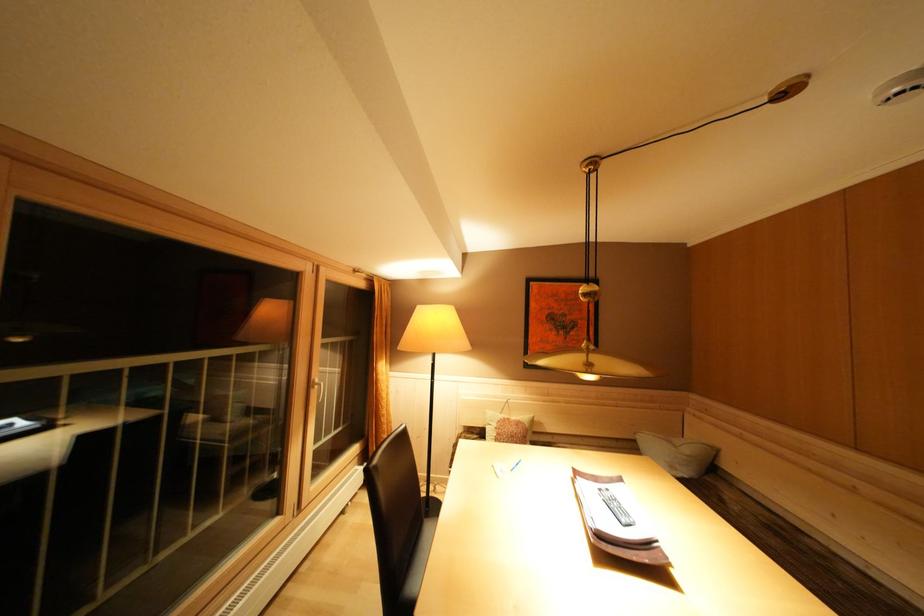
This screenshot has width=924, height=616. What are the coordinates of `grey remote control` in the screenshot? It's located at (614, 507).